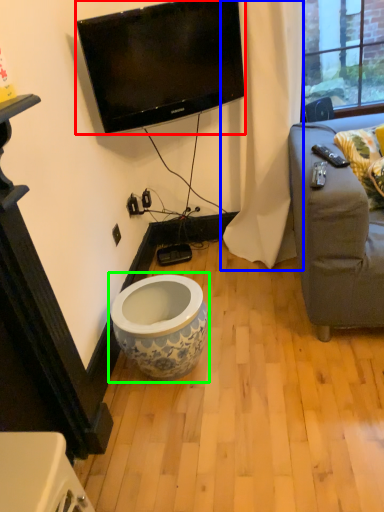
Question: Estimate the real-world distances between objects in this image. Which object is farther from television (highlighted by a red box), curtain (highlighted by a blue box) or toilet (highlighted by a green box)?

Choices:
 (A) curtain
 (B) toilet

Answer: (B)